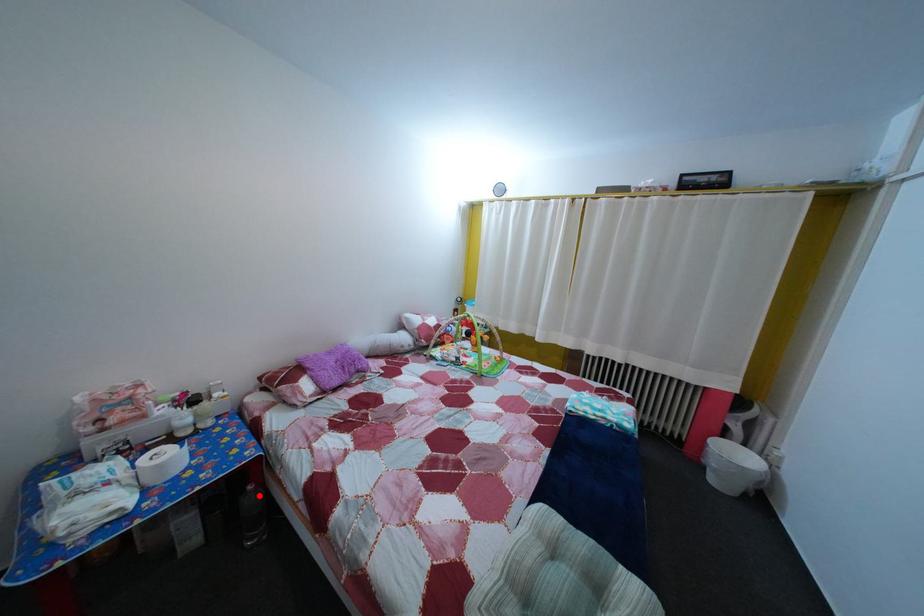
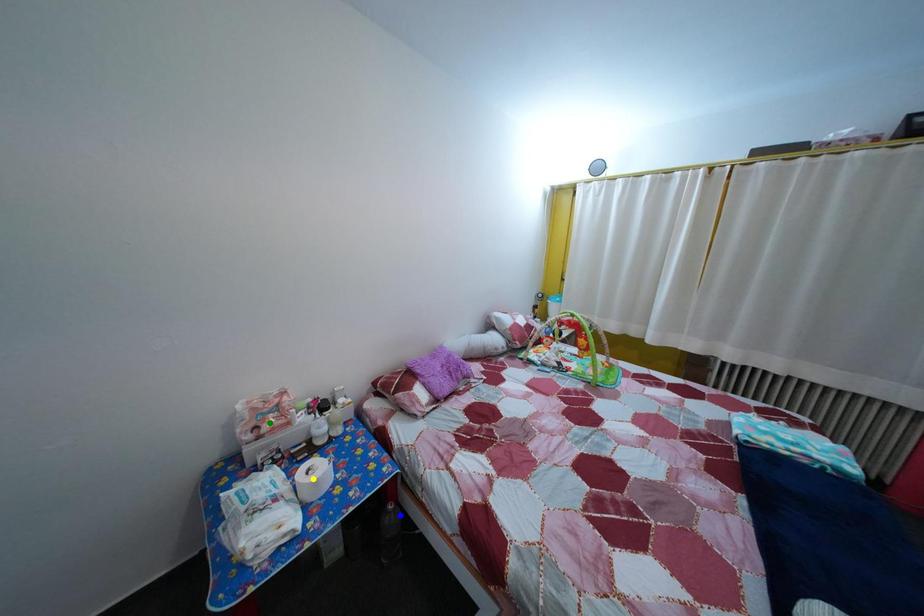
Question: I am providing you with two images of the same scene from different viewpoints. A red point is marked on the first image. You are given multiple points on the second image. Which spot in image 2 lines up with the point in image 1?

Choices:
 (A) blue point
 (B) green point
 (C) yellow point

Answer: (A)